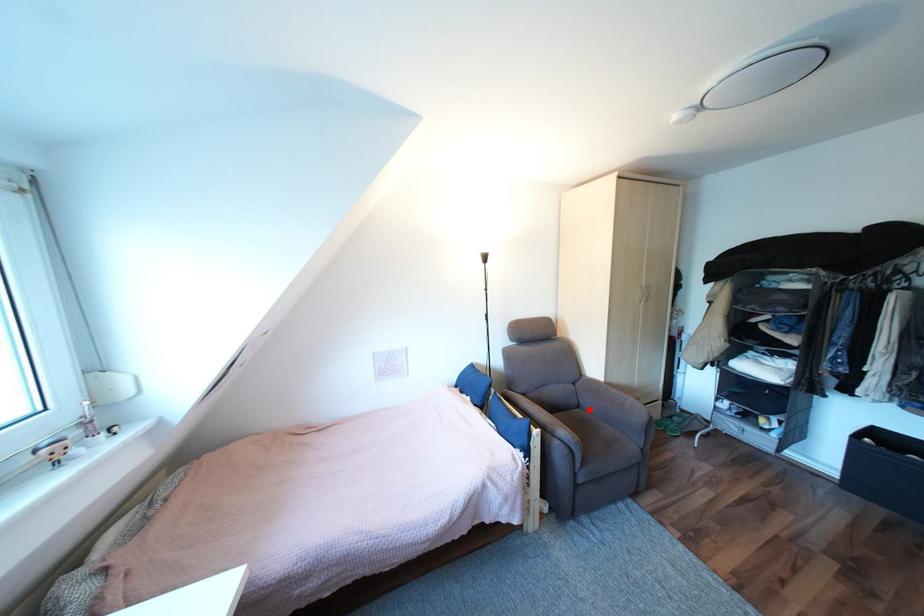
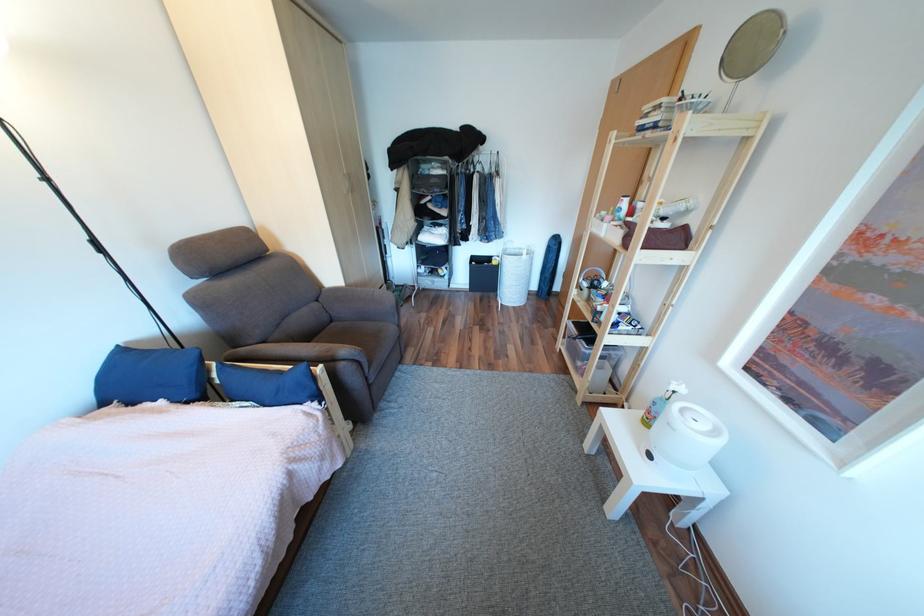
Question: A red point is marked in image1. In image2, is the corresponding 3D point closer to the camera or farther? Reply with the corresponding letter.

Choices:
 (A) The corresponding 3D point is closer.
 (B) The corresponding 3D point is farther.

Answer: (A)